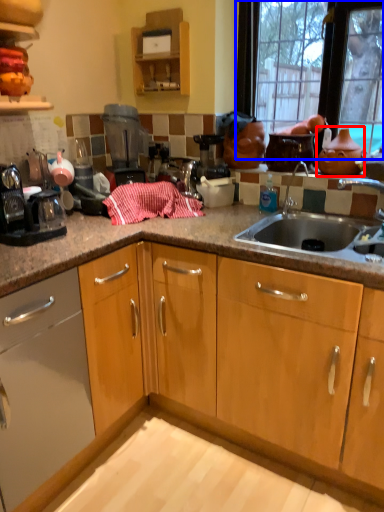
Question: Which of the following is the farthest to the observer, tea pot (highlighted by a red box) or window (highlighted by a blue box)?

Choices:
 (A) tea pot
 (B) window

Answer: (A)